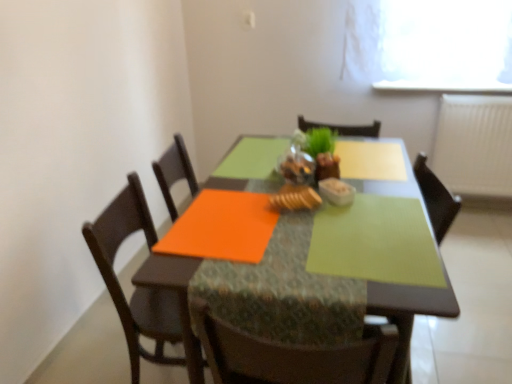
This screenshot has width=512, height=384. What are the coordinates of `vacant area that is in front of white glossy bowl at center` in the screenshot? It's located at (352, 224).